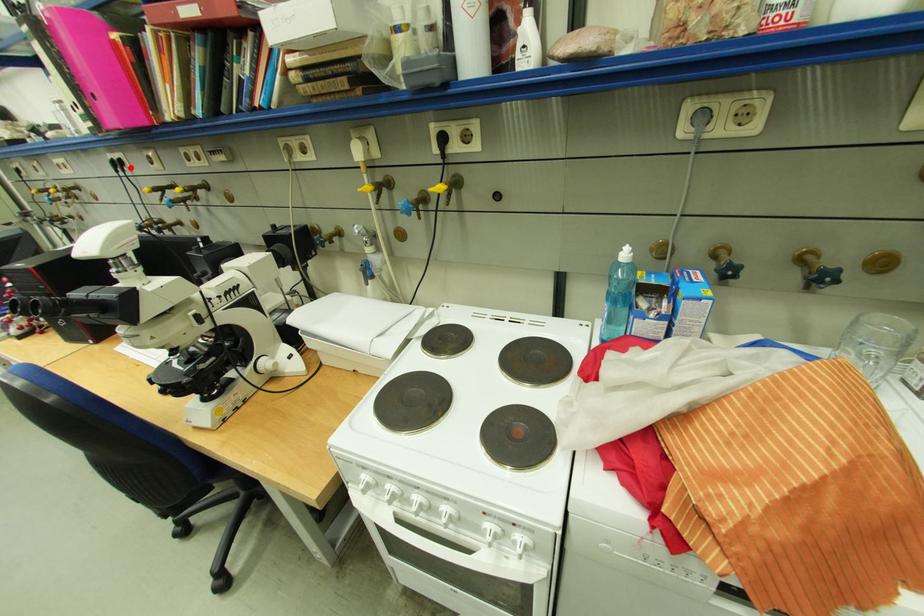
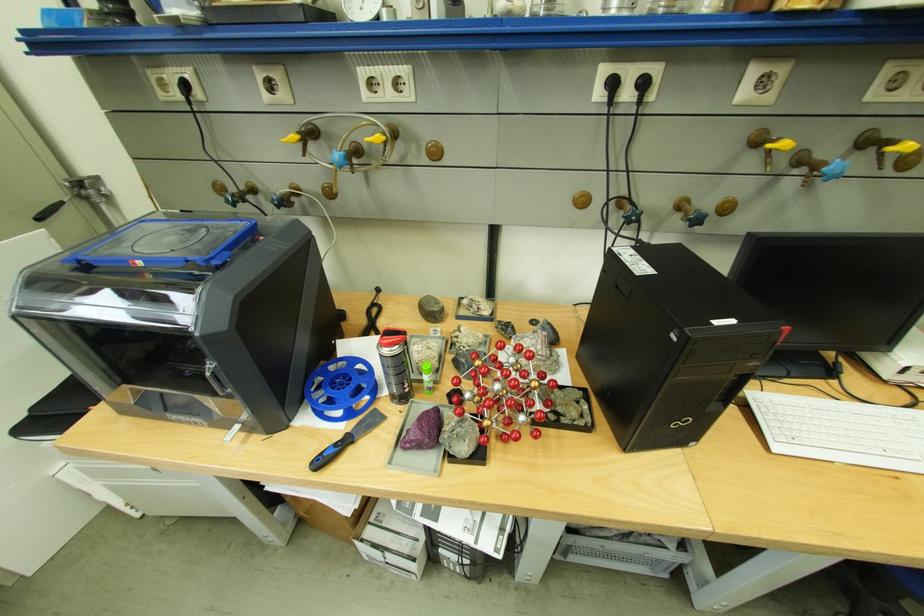
In the second image, find the point that corresponds to the highlighted location in the first image.

(638, 95)